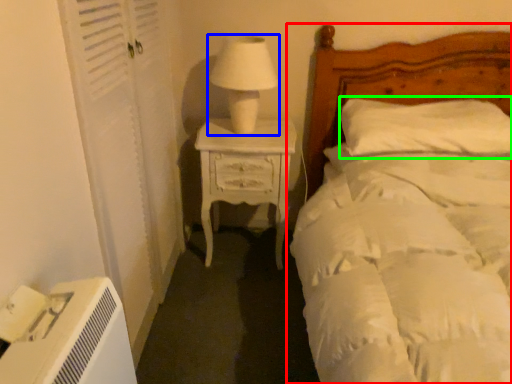
Question: Considering the real-world distances, which object is farthest from bed (highlighted by a red box)? table lamp (highlighted by a blue box) or pillow (highlighted by a green box)?

Choices:
 (A) table lamp
 (B) pillow

Answer: (A)